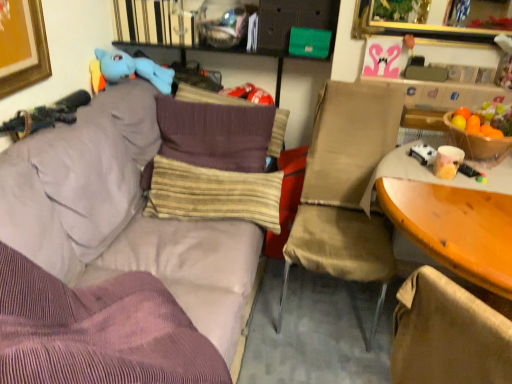
Question: Choose the correct answer: Is striped fabric pillow at center, which is the 1th pillow in front-to-back order, inside wooden table at right or outside it?

Choices:
 (A) inside
 (B) outside

Answer: (B)

Question: From a real-world perspective, is striped fabric pillow at center, acting as the 2th pillow starting from the back, positioned above or below wooden table at right?

Choices:
 (A) below
 (B) above

Answer: (A)

Question: Based on their relative distances, which object is farther from the purple corduroy pillow at center, which is counted as the 2th pillow, starting from the bottom?

Choices:
 (A) purple corduroy couch at upper left
 (B) blue plush toy at upper left
 (C) wooden table at right
 (D) beige fabric chair at center
 (E) striped fabric pillow at center, positioned as the second pillow in top-to-bottom order

Answer: (C)

Question: Which object is positioned closest to the striped fabric pillow at center, positioned as the second pillow in top-to-bottom order?

Choices:
 (A) beige fabric chair at center
 (B) purple corduroy couch at upper left
 (C) wooden table at right
 (D) purple corduroy pillow at center, marked as the 1th pillow in a top-to-bottom arrangement
 (E) blue plush toy at upper left

Answer: (B)